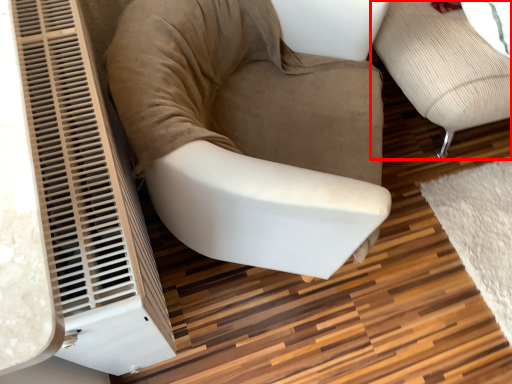
Question: In this image, where is furniture (annotated by the red box) located relative to chair?

Choices:
 (A) left
 (B) right

Answer: (B)